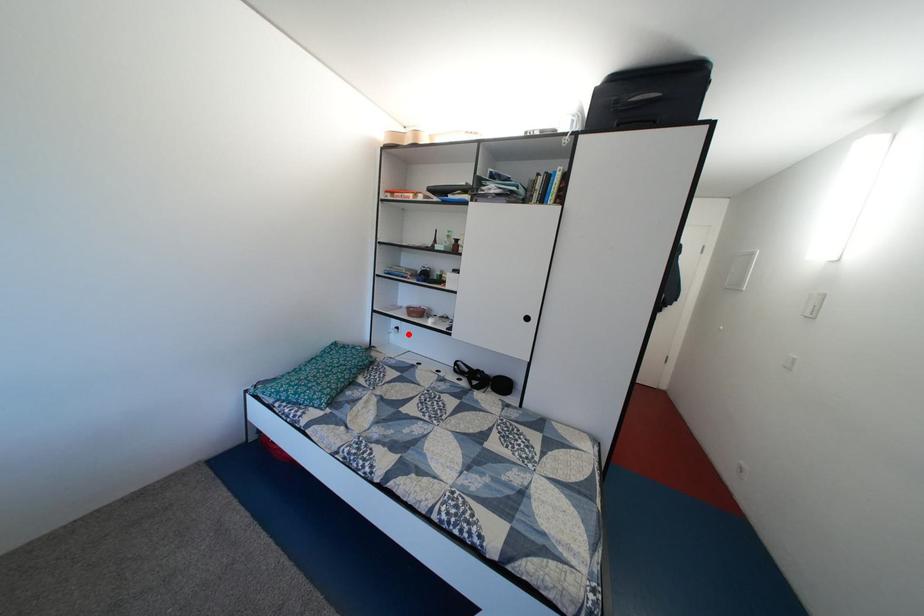
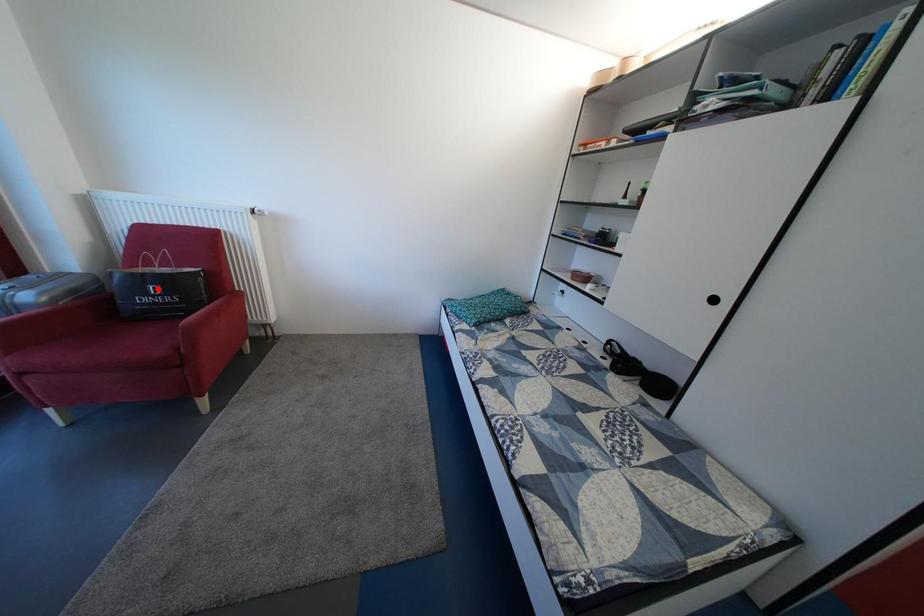
I am providing you with two images of the same scene from different viewpoints. A red point is marked on the first image and another point is marked on the second image. Does the point marked in image1 correspond to the same location as the one in image2?

No